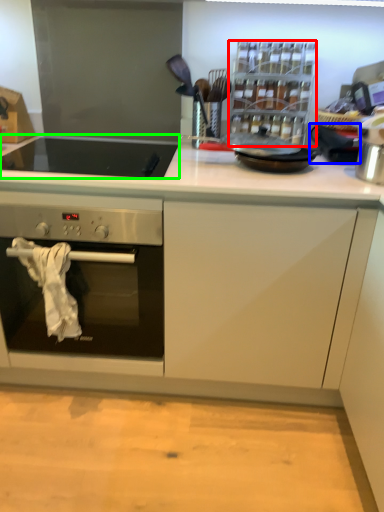
Question: Considering the real-world distances, which object is farthest from appliance (highlighted by a red box)? appliance (highlighted by a blue box) or gas stove (highlighted by a green box)?

Choices:
 (A) appliance
 (B) gas stove

Answer: (B)